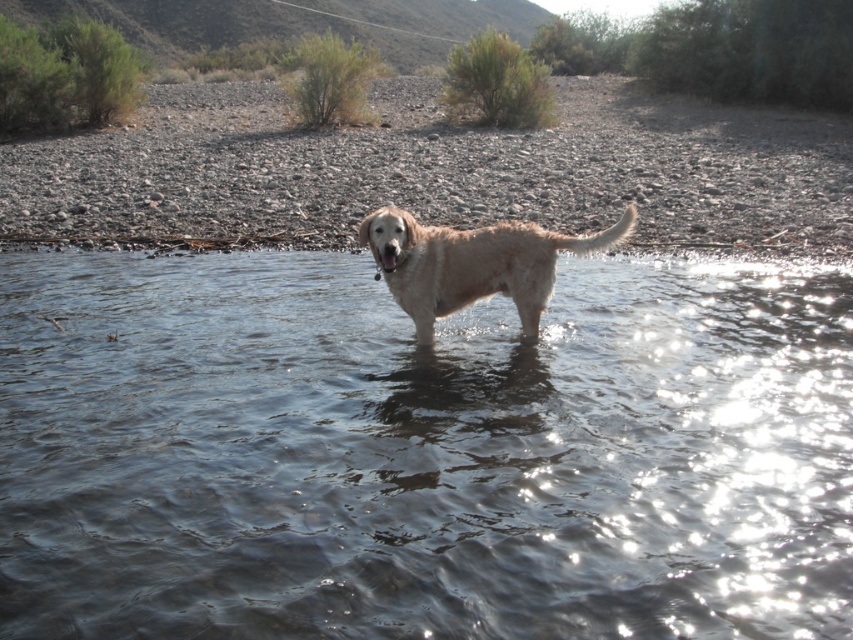
You are a photographer trying to capture the golden retriever in the scene. Since you want to focus on the dog, would the clear water at center take up more or less space in the photo compared to the fuzzy golden dog at center?

The clear water at center occupies less space than the fuzzy golden dog at center, so it will take up less space in the photo compared to the dog.

You are a photographer aiming to capture a clear shot of the fuzzy golden dog at center and the clear water at center. Since the camera can only focus on one object at a time, which object should you choose to focus on to ensure the other appears blurry?

The clear water at center is closer to the viewer than fuzzy golden dog at center. Therefore, if you focus on the clear water at center, the fuzzy golden dog at center will appear blurry. Alternatively, focusing on the fuzzy golden dog at center will leave the clear water at center blurry.